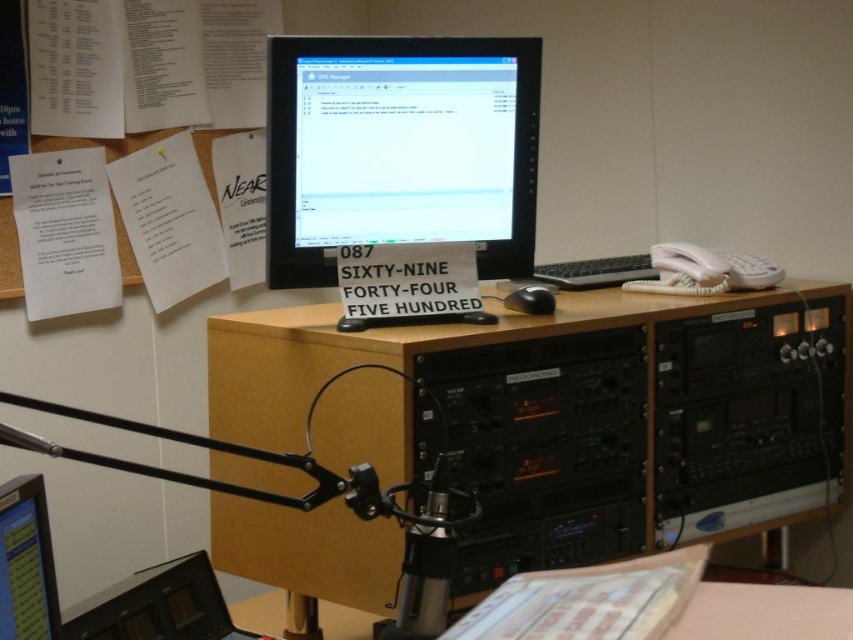
Question: Is black plastic computer desk at center to the right of black glossy monitor at lower left from the viewer's perspective?

Choices:
 (A) yes
 (B) no

Answer: (A)

Question: Which of the following is the closest to the observer?

Choices:
 (A) (424, 428)
 (B) (33, 541)
 (C) (605, 273)

Answer: (B)

Question: Among these objects, which one is farthest from the camera?

Choices:
 (A) black plastic computer desk at center
 (B) matte black monitor at center
 (C) black matte keyboard at center

Answer: (C)

Question: Does black plastic computer desk at center have a smaller size compared to matte black monitor at center?

Choices:
 (A) no
 (B) yes

Answer: (A)

Question: Does black plastic computer desk at center appear under black matte mouse at center?

Choices:
 (A) no
 (B) yes

Answer: (B)

Question: Which point is closer to the camera taking this photo?

Choices:
 (A) (270, 96)
 (B) (590, 280)
 (C) (543, 285)

Answer: (A)